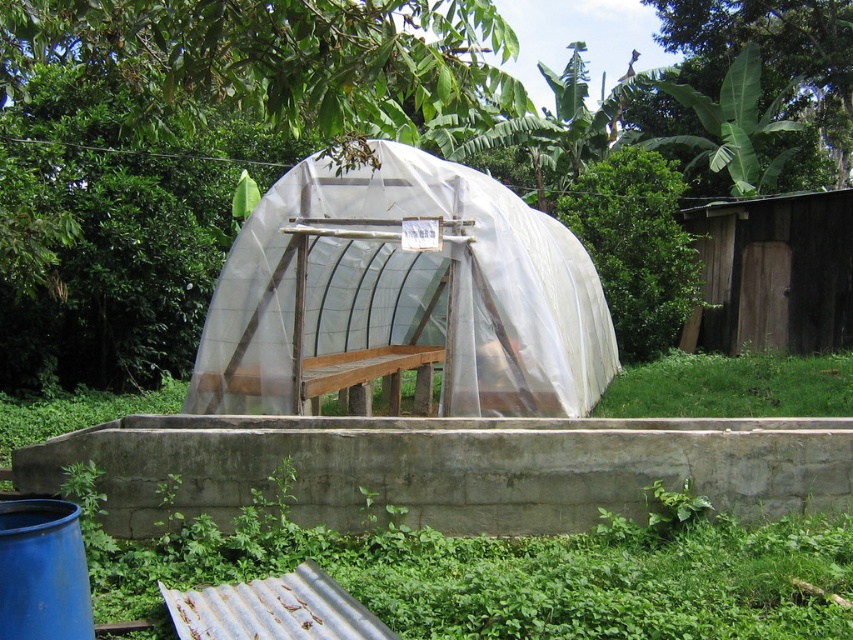
Which is in front, point (810, 296) or point (676, 408)?

Point (676, 408) is in front.

The height and width of the screenshot is (640, 853). Find the location of `wooden shed at right`. wooden shed at right is located at coordinates (773, 273).

This screenshot has height=640, width=853. What do you see at coordinates (503, 570) in the screenshot?
I see `green leafy plant at lower left` at bounding box center [503, 570].

Between green leafy plant at lower left and wooden shed at right, which one appears on the left side from the viewer's perspective?

green leafy plant at lower left

Between point (674, 628) and point (729, 294), which one is positioned behind?

Point (729, 294)

Find the location of a particular element. The height and width of the screenshot is (640, 853). green leafy plant at lower left is located at coordinates (503, 570).

Who is shorter, transparent plastic hut at center or green grass at lower right?

green grass at lower right

Is transparent plastic hut at center to the left of green grass at lower right from the viewer's perspective?

Correct, you'll find transparent plastic hut at center to the left of green grass at lower right.

Which is in front, point (310, 166) or point (814, 368)?

Point (310, 166) is in front.

Find the location of a particular element. The width and height of the screenshot is (853, 640). transparent plastic hut at center is located at coordinates (403, 296).